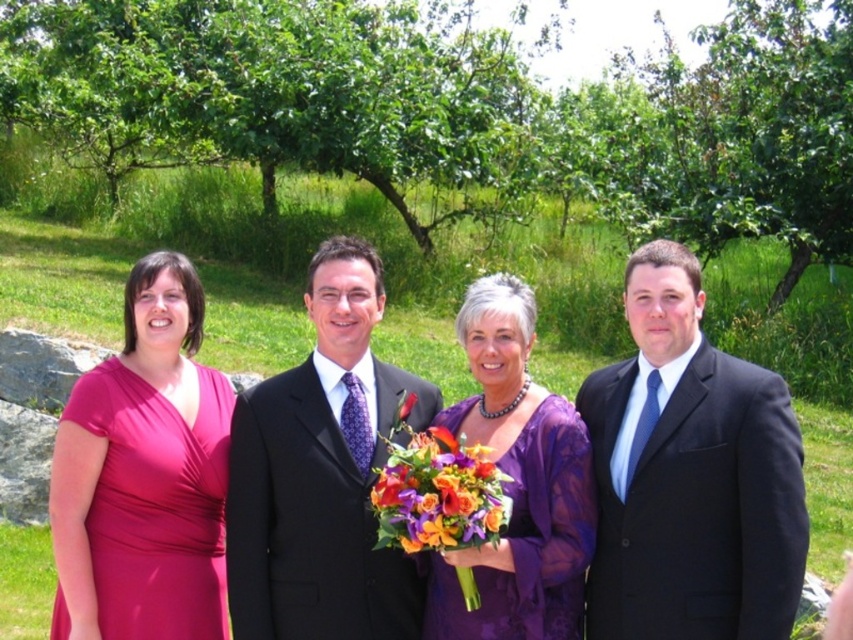
Question: Which point is farther to the camera?

Choices:
 (A) (401, 404)
 (B) (264, 477)
 (C) (712, 570)

Answer: (A)

Question: In this image, where is matte purple dress at center located relative to matte pink dress at left?

Choices:
 (A) below
 (B) above

Answer: (A)

Question: Which object is the closest to the purple lace dress at center?

Choices:
 (A) orange silk flower at center
 (B) matte purple dress at center

Answer: (B)

Question: Can you confirm if matte purple dress at center is thinner than matte black suit at right?

Choices:
 (A) yes
 (B) no

Answer: (B)

Question: Does matte black suit at right have a greater width compared to matte pink dress at left?

Choices:
 (A) yes
 (B) no

Answer: (A)

Question: Which of the following is the farthest from the observer?

Choices:
 (A) (689, 492)
 (B) (405, 412)
 (C) (254, 589)
 (D) (154, 458)

Answer: (B)